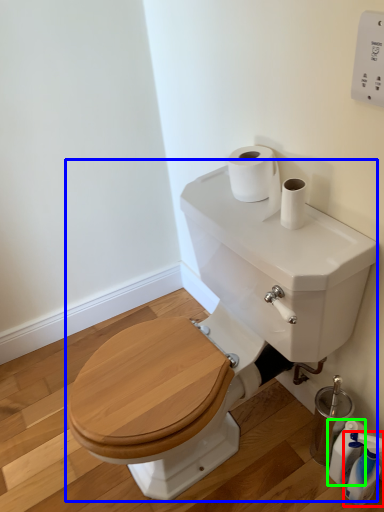
Question: Based on their relative distances, which object is farther from cleaning product (highlighted by a red box)? Choose from sink (highlighted by a blue box) and cleaning product (highlighted by a green box).

Choices:
 (A) sink
 (B) cleaning product

Answer: (A)